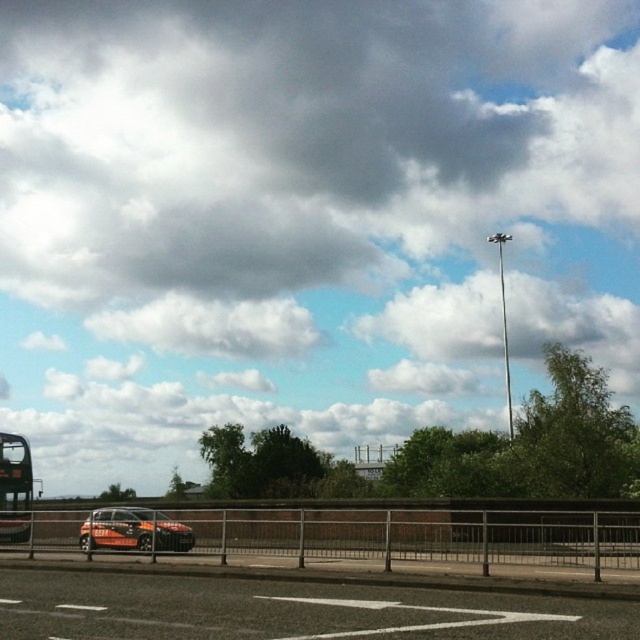
You are driving an orange matte car at lower left and want to turn right onto the smooth asphalt highway at center. Is the highway in front of your car a good spot to make the turn?

The smooth asphalt highway at center is in front of the orange matte car at lower left, so it is a suitable spot to turn right as the highway is directly ahead of the car.

You are a driver approaching the smooth asphalt highway at center and the black matte bus at left. Which object will appear taller from your perspective?

The black matte bus at left appears taller than the smooth asphalt highway at center because it has a greater height according to the description.